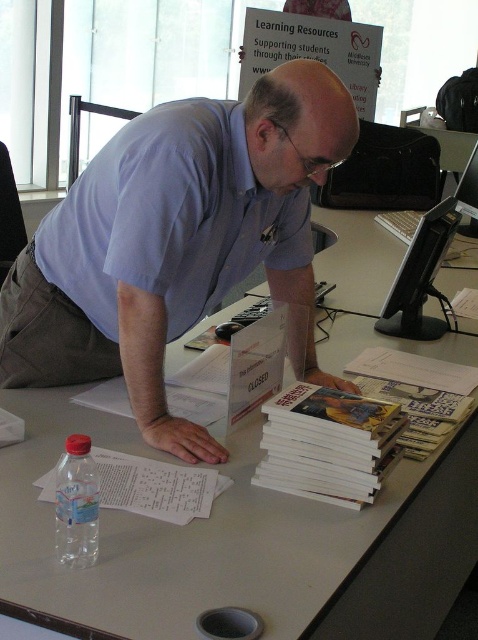
You are standing in front of the desk and see the point labeled at coordinates (156,486). Where is this point located relative to the white paper at lower left?

The point labeled at coordinates (156,486) is located on the white paper at lower left.

You are a delivery person who needs to place a package on the desk. The package is 30 centimeters long. Can you fit it horizontally between the white matte table at center and the white paper at lower left without bending it?

The distance between the white matte table at center and the white paper at lower left is 27.56 centimeters. Since the package is 30 centimeters long, it cannot fit horizontally between them without bending it.

Where is the blue cotton shirt at center located in the image?

The blue cotton shirt at center is located at point (x=173, y=240) in the image.